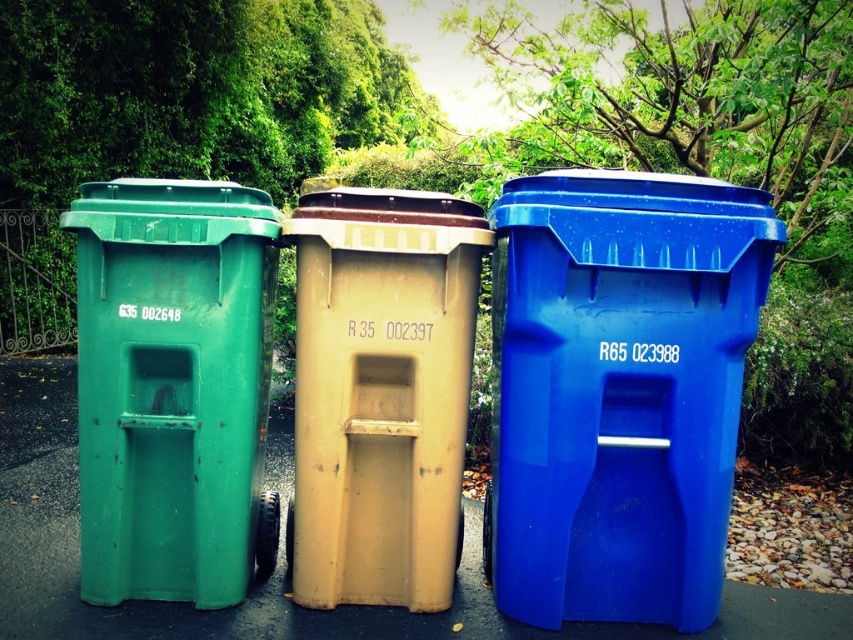
Can you confirm if blue plastic bin at center is wider than green plastic bin at left?

Incorrect, blue plastic bin at center's width does not surpass green plastic bin at left's.

Is blue plastic bin at center behind green plastic bin at left?

No, it is in front of green plastic bin at left.

Locate an element on the screen. The height and width of the screenshot is (640, 853). blue plastic bin at center is located at coordinates (618, 390).

Which is behind, point (503, 476) or point (416, 324)?

Point (503, 476)

Image resolution: width=853 pixels, height=640 pixels. What do you see at coordinates (618, 390) in the screenshot? I see `blue plastic bin at center` at bounding box center [618, 390].

Where is `blue plastic bin at center`? The width and height of the screenshot is (853, 640). blue plastic bin at center is located at coordinates (618, 390).

Can you confirm if green plastic bin at left is smaller than matte beige bin at center?

Incorrect, green plastic bin at left is not smaller in size than matte beige bin at center.

Is point (231, 298) positioned after point (334, 483)?

No, (231, 298) is closer to viewer.

Where is `green plastic bin at left`? green plastic bin at left is located at coordinates [173, 387].